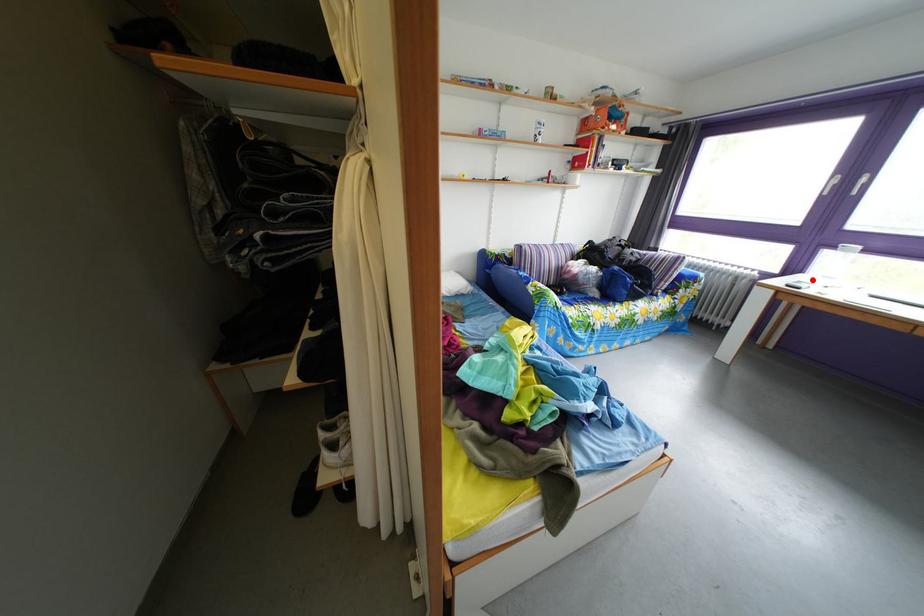
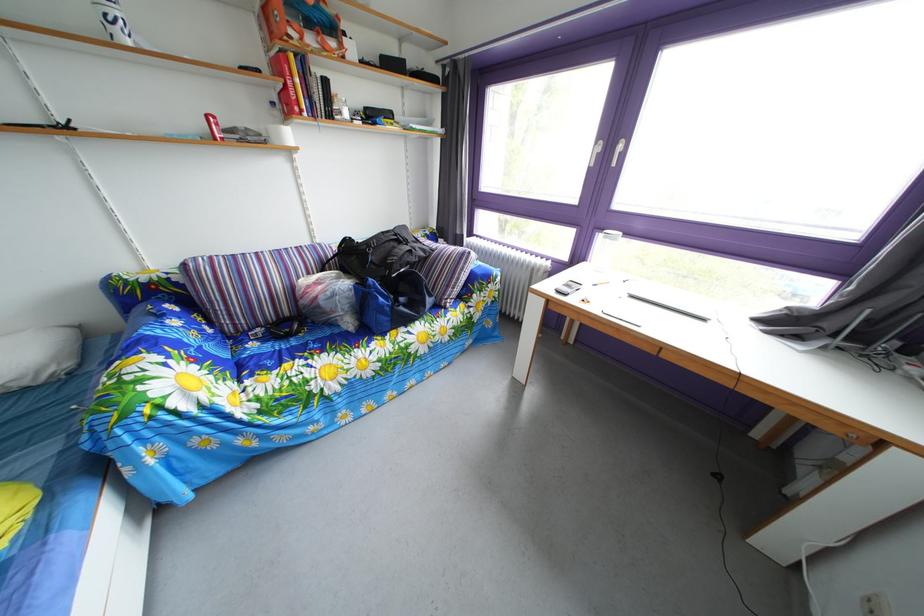
The point at the highlighted location is marked in the first image. Where is the corresponding point in the second image?

(594, 268)